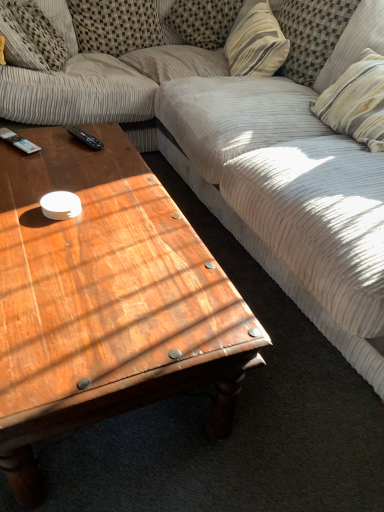
Question: Is point (170, 26) positioned closer to the camera than point (114, 136)?

Choices:
 (A) closer
 (B) farther

Answer: (B)

Question: From the image's perspective, is striped fabric pillow at upper center, which is counted as the third pillow, starting from the left, positioned above or below wooden coffee table at center?

Choices:
 (A) below
 (B) above

Answer: (B)

Question: Which object is the farthest from the striped fabric pillow at upper center, which appears as the 4th pillow when viewed from the right?

Choices:
 (A) striped fabric pillow at upper right, acting as the first pillow starting from the right
 (B) striped fabric pillow at upper right, which is the fifth pillow from left to right
 (C) checkered fabric pillow at upper left, which is the second pillow in left-to-right order
 (D) striped fabric pillow at upper center, which appears as the 4th pillow when viewed from the left
 (E) black plastic remote at center, placed as the 1th remote control when sorted from right to left

Answer: (E)

Question: Which object is the closest to the textured beige pillow at upper left, acting as the first pillow starting from the left?

Choices:
 (A) black plastic remote control at upper left, acting as the 1th remote control starting from the left
 (B) striped fabric pillow at upper center, which appears as the 4th pillow when viewed from the right
 (C) wooden coffee table at center
 (D) striped fabric pillow at upper right, acting as the first pillow starting from the right
 (E) striped fabric pillow at upper center, which appears as the 4th pillow when viewed from the left

Answer: (B)